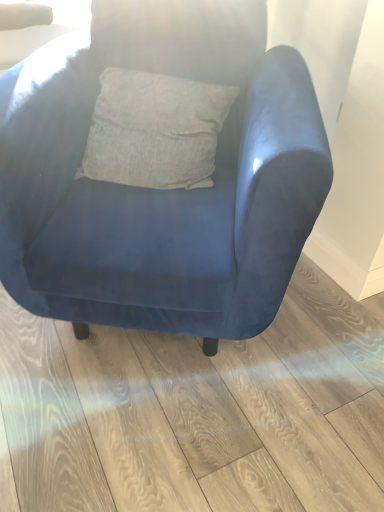
Question: From the image's perspective, does blue velvet armchair at center appear lower than velvet blue armchair at center?

Choices:
 (A) yes
 (B) no

Answer: (A)

Question: Can you confirm if blue velvet armchair at center is shorter than velvet blue armchair at center?

Choices:
 (A) no
 (B) yes

Answer: (B)

Question: Would you say velvet blue armchair at center is part of blue velvet armchair at center's contents?

Choices:
 (A) yes
 (B) no

Answer: (B)

Question: Is blue velvet armchair at center positioned with its back to velvet blue armchair at center?

Choices:
 (A) no
 (B) yes

Answer: (A)

Question: Considering the relative positions of blue velvet armchair at center and velvet blue armchair at center in the image provided, is blue velvet armchair at center to the left of velvet blue armchair at center from the viewer's perspective?

Choices:
 (A) no
 (B) yes

Answer: (A)

Question: Considering the relative sizes of blue velvet armchair at center and velvet blue armchair at center in the image provided, is blue velvet armchair at center thinner than velvet blue armchair at center?

Choices:
 (A) yes
 (B) no

Answer: (B)

Question: Considering the relative positions of velvet blue armchair at center and blue velvet armchair at center in the image provided, is velvet blue armchair at center to the left of blue velvet armchair at center from the viewer's perspective?

Choices:
 (A) no
 (B) yes

Answer: (B)

Question: Does velvet blue armchair at center have a greater height compared to blue velvet armchair at center?

Choices:
 (A) yes
 (B) no

Answer: (A)

Question: From a real-world perspective, is velvet blue armchair at center beneath blue velvet armchair at center?

Choices:
 (A) yes
 (B) no

Answer: (B)

Question: Does velvet blue armchair at center turn towards blue velvet armchair at center?

Choices:
 (A) no
 (B) yes

Answer: (A)

Question: From the image's perspective, is velvet blue armchair at center located beneath blue velvet armchair at center?

Choices:
 (A) yes
 (B) no

Answer: (B)

Question: Considering the relative sizes of velvet blue armchair at center and blue velvet armchair at center in the image provided, is velvet blue armchair at center wider than blue velvet armchair at center?

Choices:
 (A) no
 (B) yes

Answer: (A)

Question: Is velvet blue armchair at center inside the boundaries of blue velvet armchair at center, or outside?

Choices:
 (A) inside
 (B) outside

Answer: (B)